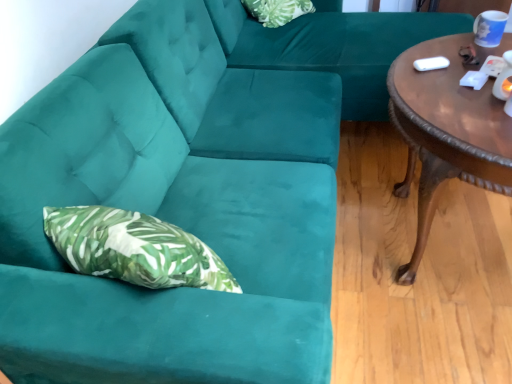
Describe the element at coordinates (332, 46) in the screenshot. I see `velvet green couch at center` at that location.

What do you see at coordinates (277, 10) in the screenshot? I see `green leafy fabric pillow at upper center` at bounding box center [277, 10].

Where is `brown polished wood coffee table at right`? Image resolution: width=512 pixels, height=384 pixels. brown polished wood coffee table at right is located at coordinates (446, 132).

Is brown polished wood coffee table at right beside green leafy fabric pillow at upper center?

No, brown polished wood coffee table at right is not beside green leafy fabric pillow at upper center.

From a real-world perspective, relative to green leafy fabric pillow at upper center, is brown polished wood coffee table at right vertically above or below?

brown polished wood coffee table at right is below green leafy fabric pillow at upper center.

Which object is further away from the camera, brown polished wood coffee table at right or green leafy fabric pillow at upper center?

green leafy fabric pillow at upper center is more distant.

From the image's perspective, is green leafy fabric pillow at upper center below brown polished wood coffee table at right?

No.

Is green leafy fabric pillow at upper center located outside brown polished wood coffee table at right?

That's correct, green leafy fabric pillow at upper center is outside of brown polished wood coffee table at right.

Considering the sizes of objects green leafy fabric pillow at upper center and brown polished wood coffee table at right in the image provided, who is smaller, green leafy fabric pillow at upper center or brown polished wood coffee table at right?

green leafy fabric pillow at upper center.

Does green leafy fabric pillow at upper center turn towards brown polished wood coffee table at right?

Yes, green leafy fabric pillow at upper center is facing brown polished wood coffee table at right.

Is green leafy fabric pillow at upper center positioned with its back to velvet green couch at center?

Yes, green leafy fabric pillow at upper center's orientation is away from velvet green couch at center.

Can you see green leafy fabric pillow at upper center touching velvet green couch at center?

No, green leafy fabric pillow at upper center is not beside velvet green couch at center.

Does green leafy fabric pillow at upper center contain velvet green couch at center?

Actually, velvet green couch at center is outside green leafy fabric pillow at upper center.

How distant is green leafy fabric pillow at upper center from velvet green couch at center?

A distance of 35.67 centimeters exists between green leafy fabric pillow at upper center and velvet green couch at center.

From a real-world perspective, which is physically below, velvet green couch at center or brown polished wood coffee table at right?

brown polished wood coffee table at right, from a real-world perspective.

How far apart are velvet green couch at center and brown polished wood coffee table at right?

velvet green couch at center is 29.75 inches away from brown polished wood coffee table at right.

From the image's perspective, who appears lower, velvet green couch at center or brown polished wood coffee table at right?

brown polished wood coffee table at right is shown below in the image.

Which point is more distant from viewer, (288, 51) or (412, 111)?

The point (288, 51) is more distant.

From a real-world perspective, which object stands above the other?

From a 3D spatial view, green leafy fabric pillow at upper center is above.

Is velvet green couch at center not close to green leafy fabric pillow at upper center?

velvet green couch at center is near green leafy fabric pillow at upper center, not far away.

Which object is positioned more to the left, velvet green couch at center or green leafy fabric pillow at upper center?

green leafy fabric pillow at upper center.

At what (x,y) coordinates should I click in order to perform the action: click on coffee table lying in front of the velvet green couch at center. Please return your answer as a coordinate pair (x, y). Looking at the image, I should click on (446, 132).

Does brown polished wood coffee table at right have a greater width compared to velvet green couch at center?

In fact, brown polished wood coffee table at right might be narrower than velvet green couch at center.

Is velvet green couch at center at the back of brown polished wood coffee table at right?

No, brown polished wood coffee table at right's orientation is not away from velvet green couch at center.

Which is more to the right, brown polished wood coffee table at right or velvet green couch at center?

From the viewer's perspective, brown polished wood coffee table at right appears more on the right side.

The height and width of the screenshot is (384, 512). I want to click on pillow above the brown polished wood coffee table at right (from a real-world perspective), so click(x=277, y=10).

Where is `coffee table in front of the green leafy fabric pillow at upper center`? The image size is (512, 384). coffee table in front of the green leafy fabric pillow at upper center is located at coordinates (446, 132).

Which object lies nearer to the anchor point green leafy fabric pillow at upper center, brown polished wood coffee table at right or velvet green couch at center?

velvet green couch at center.

Looking at the image, which one is located further to velvet green couch at center, brown polished wood coffee table at right or green leafy fabric pillow at upper center?

Based on the image, brown polished wood coffee table at right appears to be further to velvet green couch at center.

Estimate the real-world distances between objects in this image. Which object is closer to brown polished wood coffee table at right, velvet green couch at center or green leafy fabric pillow at upper center?

velvet green couch at center lies closer to brown polished wood coffee table at right than the other object.

Looking at the image, which one is located further to green leafy fabric pillow at upper center, velvet green couch at center or brown polished wood coffee table at right?

brown polished wood coffee table at right.

Which object lies further to the anchor point velvet green couch at center, green leafy fabric pillow at upper center or brown polished wood coffee table at right?

brown polished wood coffee table at right lies further to velvet green couch at center than the other object.

Which object lies further to the anchor point brown polished wood coffee table at right, green leafy fabric pillow at upper center or velvet green couch at center?

Among the two, green leafy fabric pillow at upper center is located further to brown polished wood coffee table at right.

At what (x,y) coordinates should I click in order to perform the action: click on couch located between brown polished wood coffee table at right and green leafy fabric pillow at upper center in the depth direction. Please return your answer as a coordinate pair (x, y). Looking at the image, I should click on (332, 46).